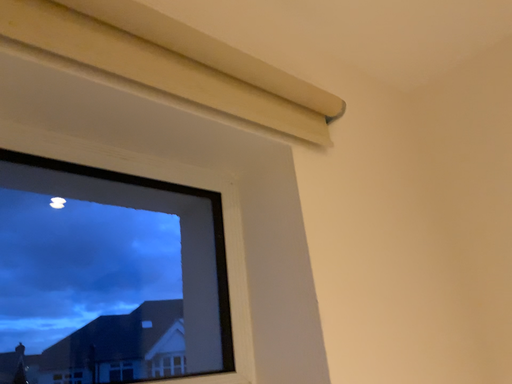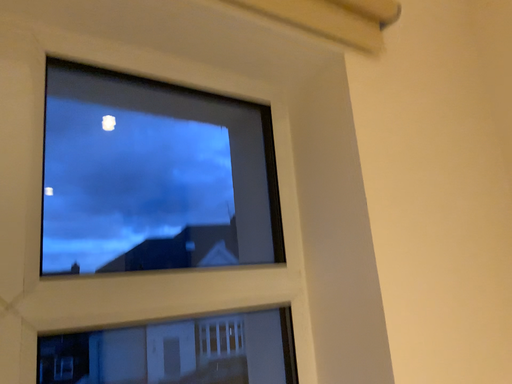
Question: How did the camera likely rotate when shooting the video?

Choices:
 (A) rotated downward
 (B) rotated upward

Answer: (A)